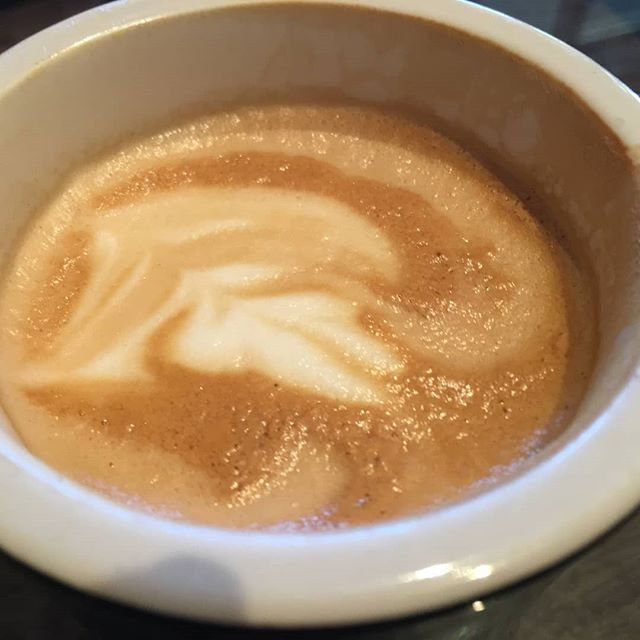
Locate an element on the screen. This screenshot has height=640, width=640. coffee residue on inside of cup is located at coordinates (479, 108), (564, 176).